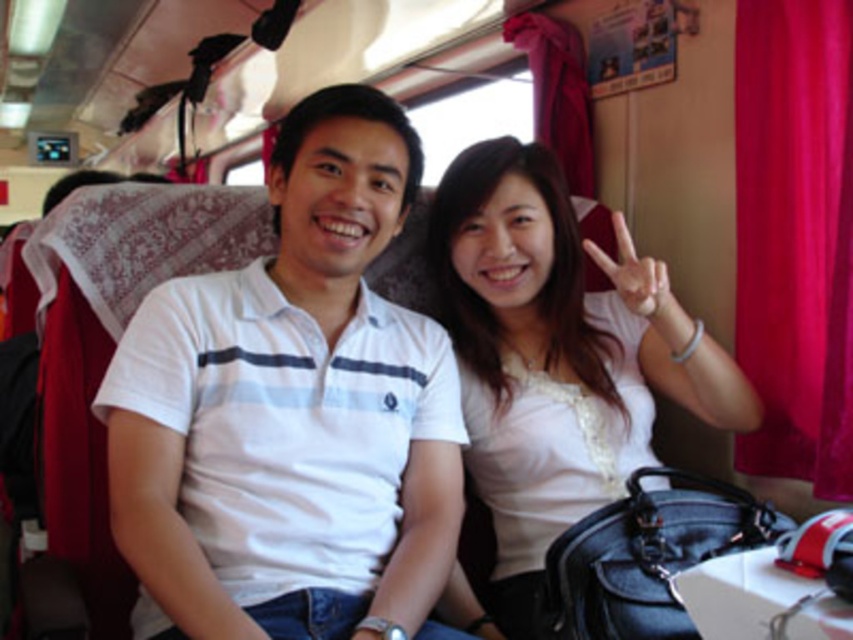
Is white satin blouse at center below red velvet curtain at right?

Correct, white satin blouse at center is located below red velvet curtain at right.

This screenshot has width=853, height=640. What do you see at coordinates (556, 358) in the screenshot?
I see `white satin blouse at center` at bounding box center [556, 358].

Find the location of `white satin blouse at center`. white satin blouse at center is located at coordinates (556, 358).

Can you confirm if white cotton shirt at center is wider than white satin blouse at center?

No.

Does white cotton shirt at center lie behind white satin blouse at center?

No, it is in front of white satin blouse at center.

Measure the distance between point (293,548) and camera.

Point (293,548) and camera are 1.20 meters apart.

I want to click on white cotton shirt at center, so click(293, 408).

Measure the distance between white cotton shirt at center and camera.

white cotton shirt at center and camera are 3.36 feet apart from each other.

Does white cotton shirt at center appear on the right side of red velvet curtain at right?

Incorrect, white cotton shirt at center is not on the right side of red velvet curtain at right.

Between point (242, 600) and point (740, 74), which one is positioned in front?

Point (242, 600)

The image size is (853, 640). In order to click on white cotton shirt at center in this screenshot , I will do `click(293, 408)`.